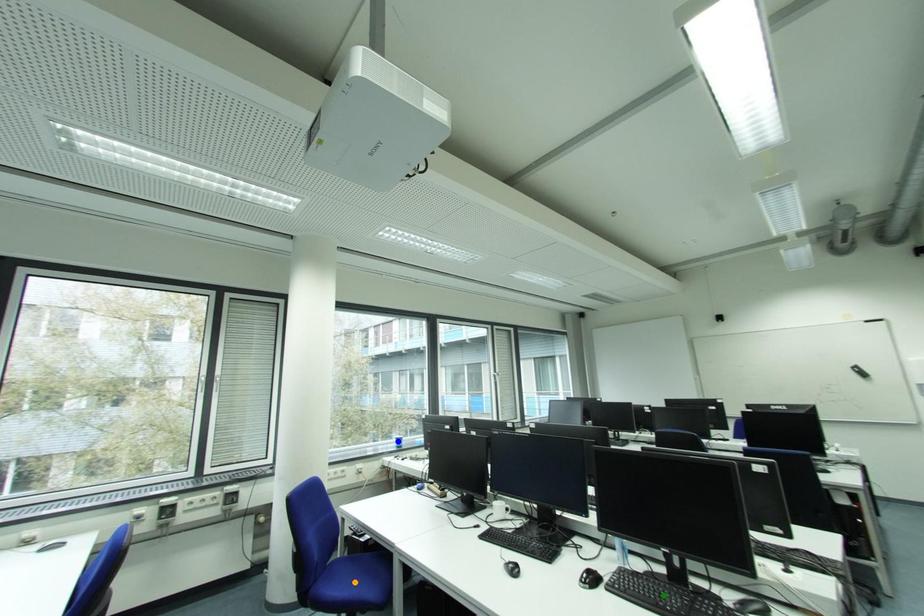
Order these from nearest to farthest:
green point | blue point | orange point

1. blue point
2. orange point
3. green point